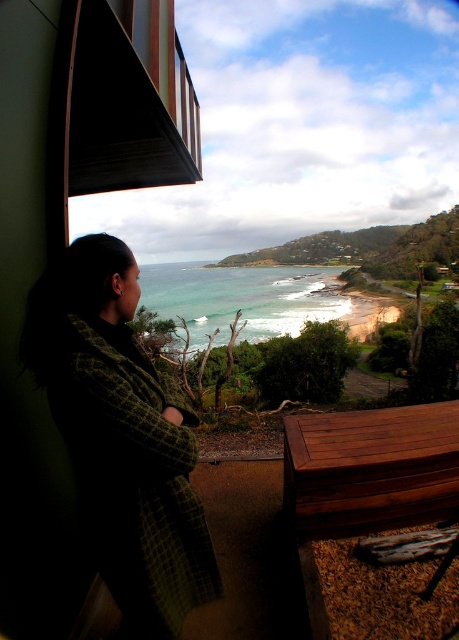
Does rustic wood balcony at upper left appear on the left side of green water at center?

In fact, rustic wood balcony at upper left is to the right of green water at center.

Which is above, rustic wood balcony at upper left or green water at center?

green water at center is higher up.

The width and height of the screenshot is (459, 640). What do you see at coordinates (130, 99) in the screenshot?
I see `rustic wood balcony at upper left` at bounding box center [130, 99].

I want to click on rustic wood balcony at upper left, so click(130, 99).

Between green checkered coat at left and rustic wood balcony at upper left, which one has less height?

green checkered coat at left is shorter.

Is green checkered coat at left smaller than rustic wood balcony at upper left?

Indeed, green checkered coat at left has a smaller size compared to rustic wood balcony at upper left.

Between point (141, 460) and point (84, 49), which one is positioned behind?

The point (84, 49) is behind.

What are the coordinates of `green checkered coat at left` in the screenshot? It's located at (122, 436).

Where is `green checkered coat at left`? green checkered coat at left is located at coordinates (122, 436).

Can you confirm if green checkered coat at left is positioned to the left of green water at center?

In fact, green checkered coat at left is to the right of green water at center.

Does point (102, 380) come behind point (251, 316)?

That is False.

Where is `green checkered coat at left`? Image resolution: width=459 pixels, height=640 pixels. green checkered coat at left is located at coordinates (122, 436).